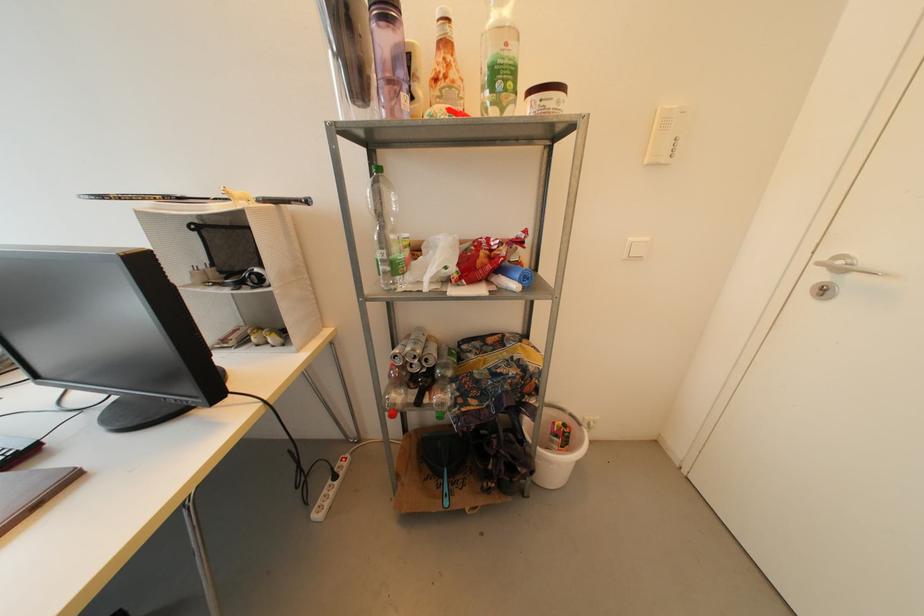
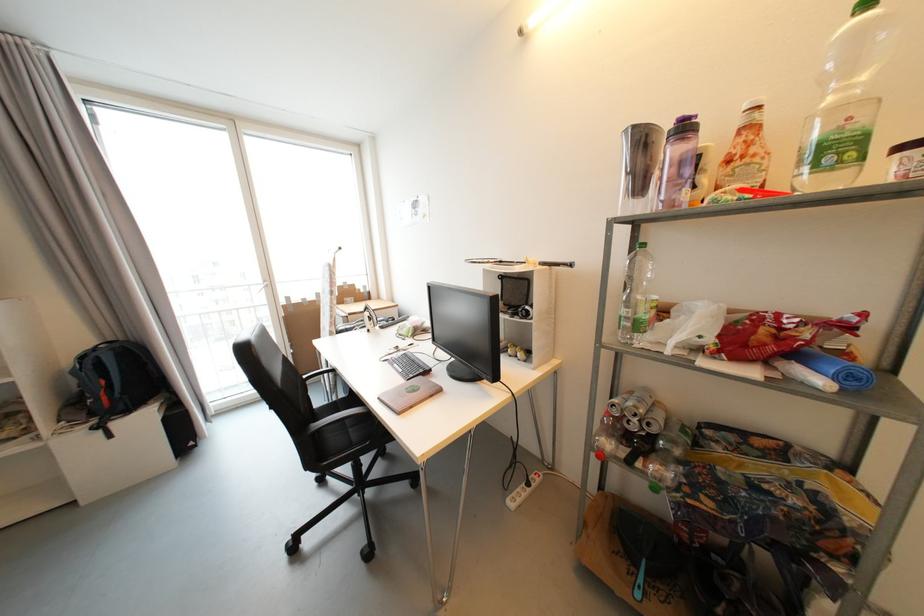
In the second image, find the point that corresponds to [505,272] in the first image.

(801, 357)